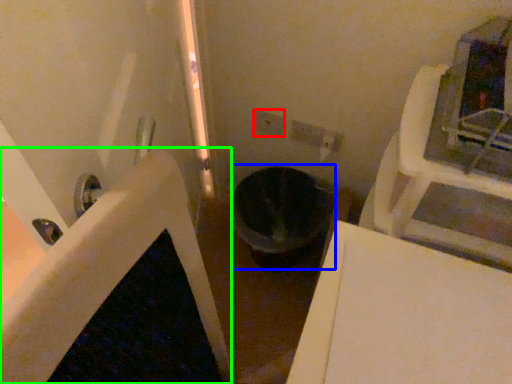
Question: Based on their relative distances, which object is farther from electric outlet (highlighted by a red box)? Choose from toilet bowl (highlighted by a blue box) and bath (highlighted by a green box).

Choices:
 (A) toilet bowl
 (B) bath

Answer: (B)